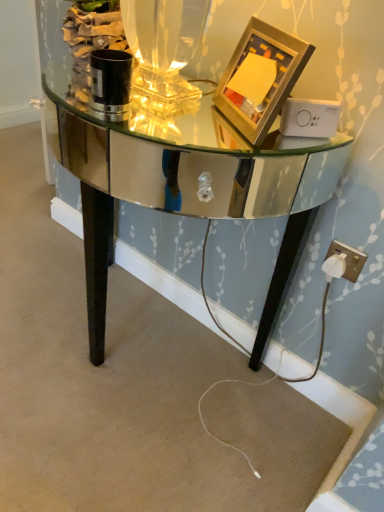
Question: Considering the relative sizes of mirrored glass table at center and white plastic plug at lower right in the image provided, is mirrored glass table at center shorter than white plastic plug at lower right?

Choices:
 (A) yes
 (B) no

Answer: (B)

Question: Considering the relative sizes of mirrored glass table at center and white plastic plug at lower right in the image provided, is mirrored glass table at center thinner than white plastic plug at lower right?

Choices:
 (A) yes
 (B) no

Answer: (B)

Question: Is mirrored glass table at center surrounding white plastic plug at lower right?

Choices:
 (A) yes
 (B) no

Answer: (B)

Question: From the image's perspective, does mirrored glass table at center appear lower than white plastic plug at lower right?

Choices:
 (A) yes
 (B) no

Answer: (B)

Question: From the image's perspective, is mirrored glass table at center located above white plastic plug at lower right?

Choices:
 (A) no
 (B) yes

Answer: (B)

Question: In terms of height, does gold metallic picture frame at upper right look taller or shorter compared to white plastic plug at lower right?

Choices:
 (A) tall
 (B) short

Answer: (A)

Question: From the image's perspective, relative to white plastic plug at lower right, is gold metallic picture frame at upper right above or below?

Choices:
 (A) above
 (B) below

Answer: (A)

Question: From a real-world perspective, is gold metallic picture frame at upper right above or below white plastic plug at lower right?

Choices:
 (A) below
 (B) above

Answer: (B)

Question: Is gold metallic picture frame at upper right wider or thinner than white plastic plug at lower right?

Choices:
 (A) thin
 (B) wide

Answer: (B)

Question: From the image's perspective, is white plastic plug at lower right positioned above or below gold metallic picture frame at upper right?

Choices:
 (A) below
 (B) above

Answer: (A)

Question: From a real-world perspective, is white plastic plug at lower right positioned above or below gold metallic picture frame at upper right?

Choices:
 (A) below
 (B) above

Answer: (A)

Question: Based on their positions, is white plastic plug at lower right located to the left or right of gold metallic picture frame at upper right?

Choices:
 (A) left
 (B) right

Answer: (B)

Question: In terms of width, does white plastic plug at lower right look wider or thinner when compared to gold metallic picture frame at upper right?

Choices:
 (A) thin
 (B) wide

Answer: (A)

Question: From the image's perspective, relative to gold metallic picture frame at upper right, is mirrored glass table at center above or below?

Choices:
 (A) above
 (B) below

Answer: (B)

Question: In terms of size, does mirrored glass table at center appear bigger or smaller than gold metallic picture frame at upper right?

Choices:
 (A) small
 (B) big

Answer: (B)